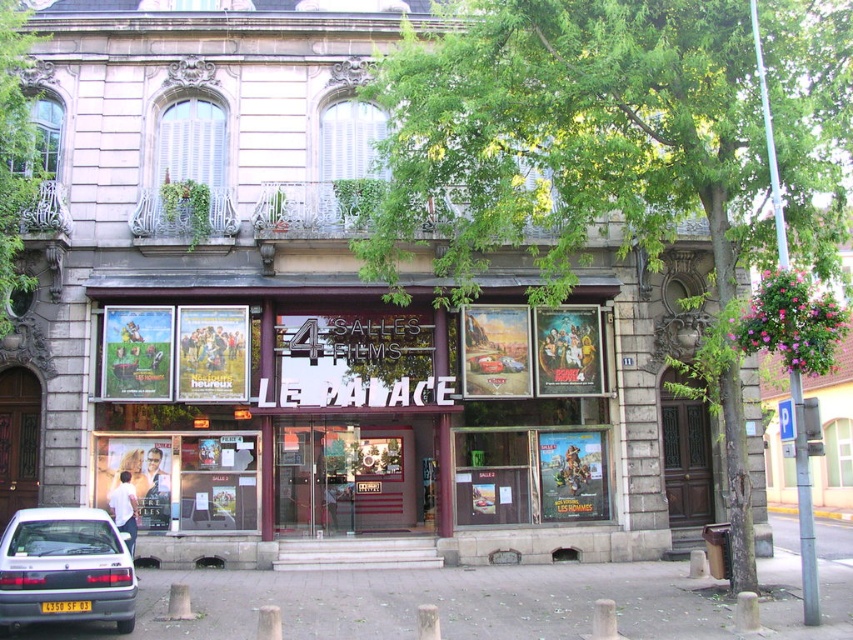
You are standing in front of the cinema entrance and want to take a photo that includes both point (596, 472) and point (366, 145). Since one is closer to you than the other, which point should you focus on to ensure both are in focus?

You should focus on point (366, 145) because it is farther away from the camera than point (596, 472). By focusing on the farther point, both points will be within the depth of field and in focus.